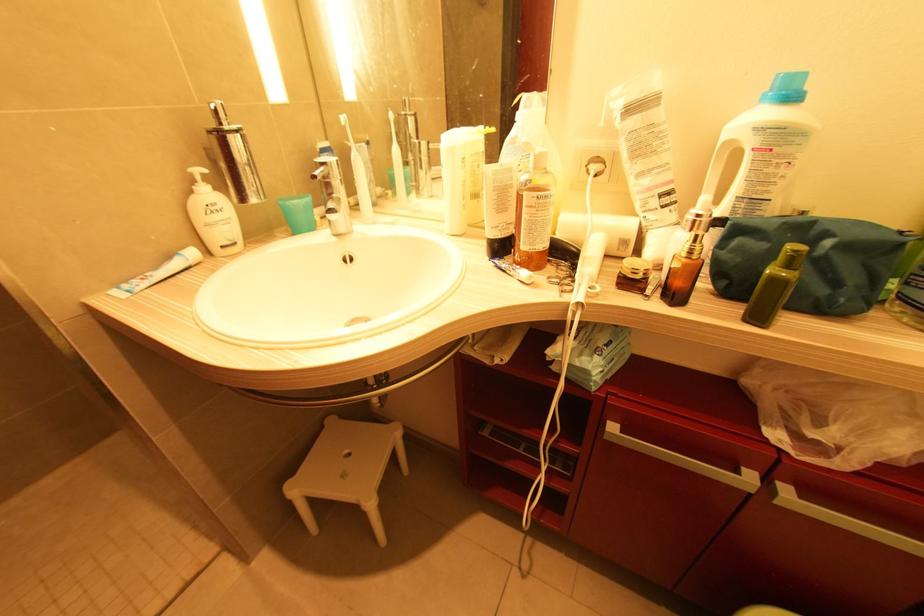
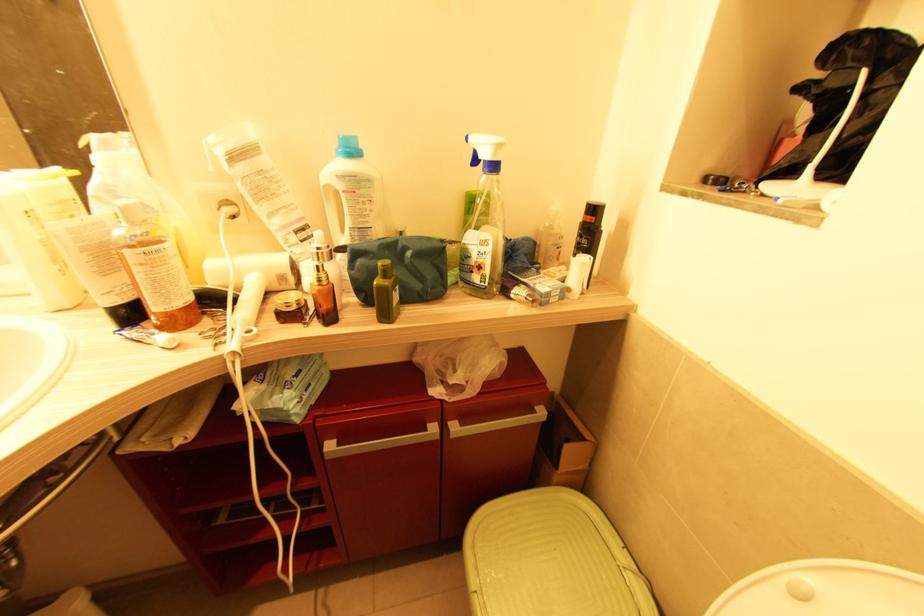
In the second image, find the point that corresponds to point 830,244 in the first image.

(409, 254)